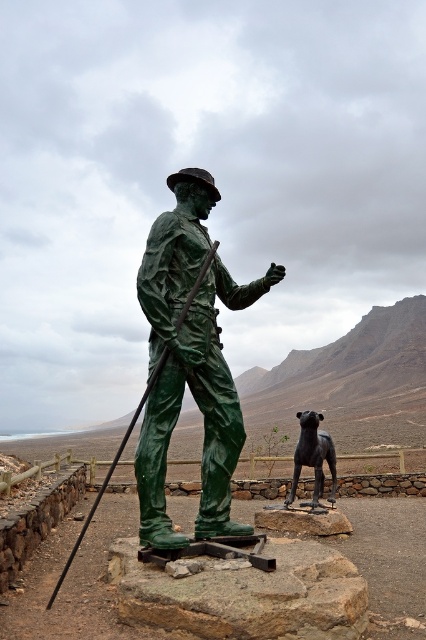
The height and width of the screenshot is (640, 426). In order to click on green polished bronze statue at center in this screenshot , I will do `click(189, 362)`.

Is green polished bronze statue at center further to the viewer compared to shiny black statue at center?

That is False.

Locate an element on the screen. The image size is (426, 640). green polished bronze statue at center is located at coordinates (189, 362).

Find the location of a particular element. Image resolution: width=426 pixels, height=640 pixels. green polished bronze statue at center is located at coordinates (189, 362).

Where is `green polished bronze statue at center`? This screenshot has width=426, height=640. green polished bronze statue at center is located at coordinates click(189, 362).

Describe the element at coordinates (189, 362) in the screenshot. The height and width of the screenshot is (640, 426). I see `green polished bronze statue at center` at that location.

Identify the location of green polished bronze statue at center. (189, 362).

Is granite rock at center to the right of shiny black statue at center from the viewer's perspective?

No, granite rock at center is not to the right of shiny black statue at center.

Who is more distant from viewer, (124, 598) or (328, 442)?

Positioned behind is point (328, 442).

This screenshot has width=426, height=640. What are the coordinates of `granite rock at center` in the screenshot? It's located at (244, 593).